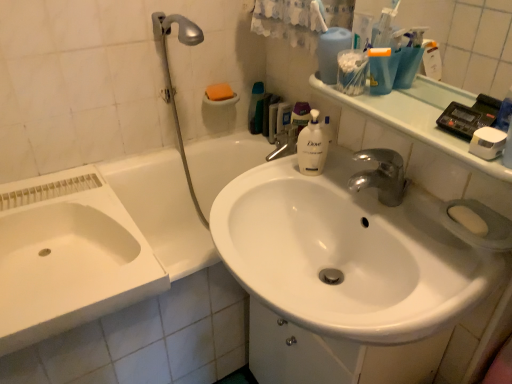
Locate an element on the screen. vacant region to the left of white matte liquid soap at center, acting as the 1th cleaning product starting from the right is located at coordinates (264, 183).